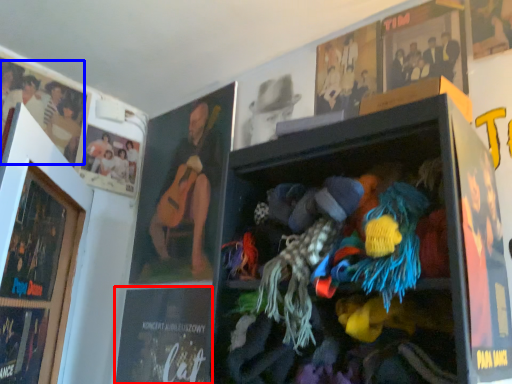
Question: Among these objects, which one is farthest to the camera, magazine (highlighted by a red box) or person (highlighted by a blue box)?

Choices:
 (A) magazine
 (B) person

Answer: (B)